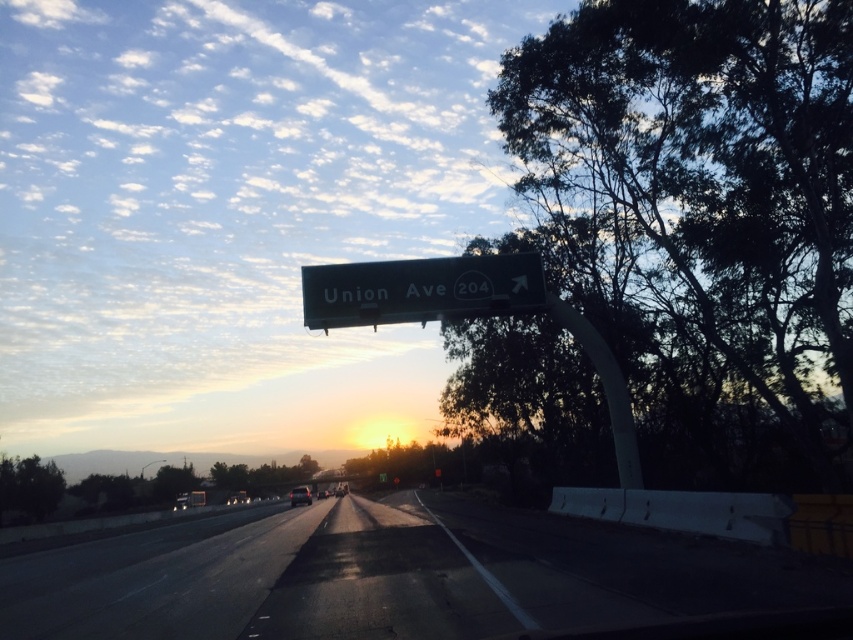
Is green leafy tree at lower left wider than shiny silver sedan at center?

Indeed, green leafy tree at lower left has a greater width compared to shiny silver sedan at center.

Is point (61, 490) closer to camera compared to point (291, 497)?

No, (61, 490) is further to viewer.

Who is more distant from viewer, [56,486] or [308,500]?

The point [308,500] is behind.

Where is `green leafy tree at lower left`? green leafy tree at lower left is located at coordinates (28, 486).

Who is taller, black asphalt highway at center or green leafy tree at lower left?

With more height is black asphalt highway at center.

Does black asphalt highway at center have a smaller size compared to green leafy tree at lower left?

No.

Locate an element on the screen. black asphalt highway at center is located at coordinates (395, 577).

The height and width of the screenshot is (640, 853). I want to click on black asphalt highway at center, so click(x=395, y=577).

Does green metallic sign at center have a greater height compared to green leafy tree at lower left?

Yes.

Can you confirm if green metallic sign at center is wider than green leafy tree at lower left?

In fact, green metallic sign at center might be narrower than green leafy tree at lower left.

The width and height of the screenshot is (853, 640). Describe the element at coordinates (421, 289) in the screenshot. I see `green metallic sign at center` at that location.

This screenshot has height=640, width=853. What are the coordinates of `green metallic sign at center` in the screenshot? It's located at (421, 289).